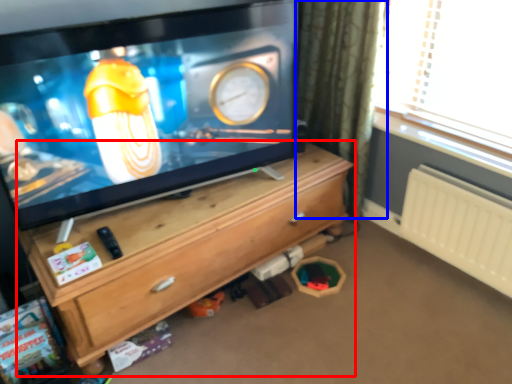
Question: Which object is further to the camera taking this photo, chest of drawers (highlighted by a red box) or curtain (highlighted by a blue box)?

Choices:
 (A) chest of drawers
 (B) curtain

Answer: (B)